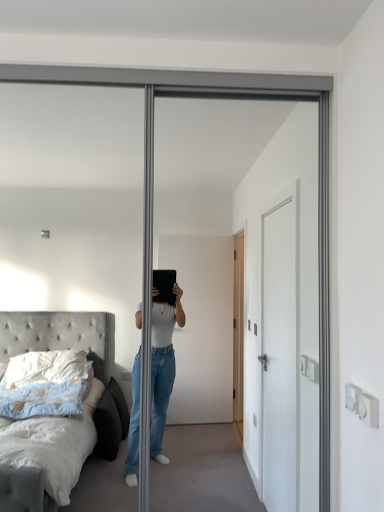
Find the location of a particular element. The width and height of the screenshot is (384, 512). white glossy door at center is located at coordinates (246, 276).

The width and height of the screenshot is (384, 512). What do you see at coordinates (246, 276) in the screenshot?
I see `white glossy door at center` at bounding box center [246, 276].

I want to click on white glossy door at center, so click(246, 276).